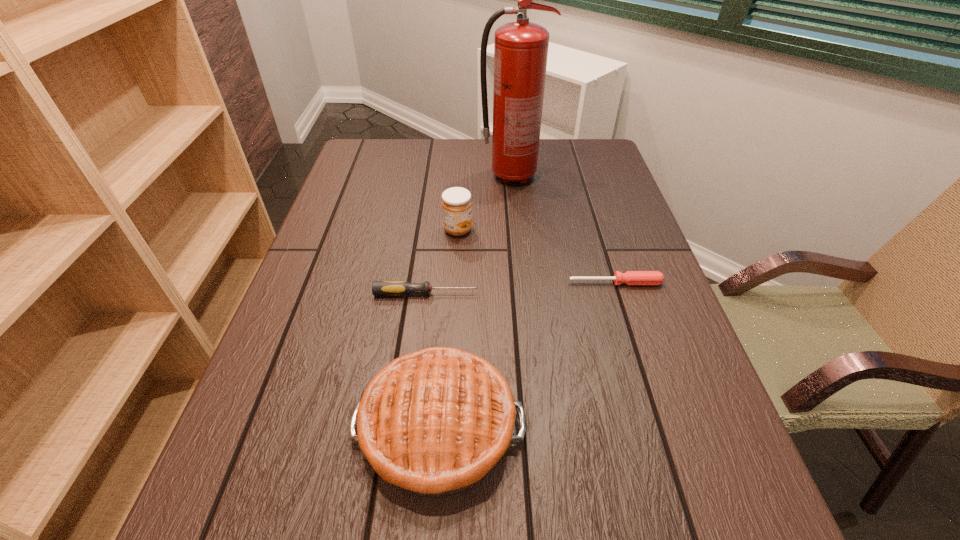
In order to click on free space located on the right of the pie in this screenshot , I will do `click(612, 427)`.

At what (x,y) coordinates should I click in order to perform the action: click on blank space located insert the nearer screwdriver into a screw head. Please return your answer as a coordinate pair (x, y). The width and height of the screenshot is (960, 540). Looking at the image, I should click on (585, 293).

Where is `free space located 0.110m on the left of the rightmost object`? This screenshot has width=960, height=540. free space located 0.110m on the left of the rightmost object is located at coordinates (521, 283).

Where is `object that is at the far edge`? object that is at the far edge is located at coordinates (520, 48).

You are a GUI agent. You are given a task and a screenshot of the screen. Output one action in this format:
    pyautogui.click(x=<x>, y=<y>)
    Task: Click on the object that is positioned at the right edge
    This screenshot has width=960, height=540.
    Given the screenshot: What is the action you would take?
    pyautogui.click(x=630, y=277)

This screenshot has height=540, width=960. Identify the location of free space at the far edge. (461, 166).

In the image, there is a desktop. Where is `blank space at the near edge`? This screenshot has width=960, height=540. blank space at the near edge is located at coordinates (640, 524).

In the image, there is a desktop. Where is `vacant space at the left edge`? vacant space at the left edge is located at coordinates (344, 210).

In the image, there is a desktop. In order to click on free space at the right edge in this screenshot , I will do `click(596, 203)`.

What are the coordinates of `vacant space at the far left corner of the desktop` in the screenshot? It's located at (372, 141).